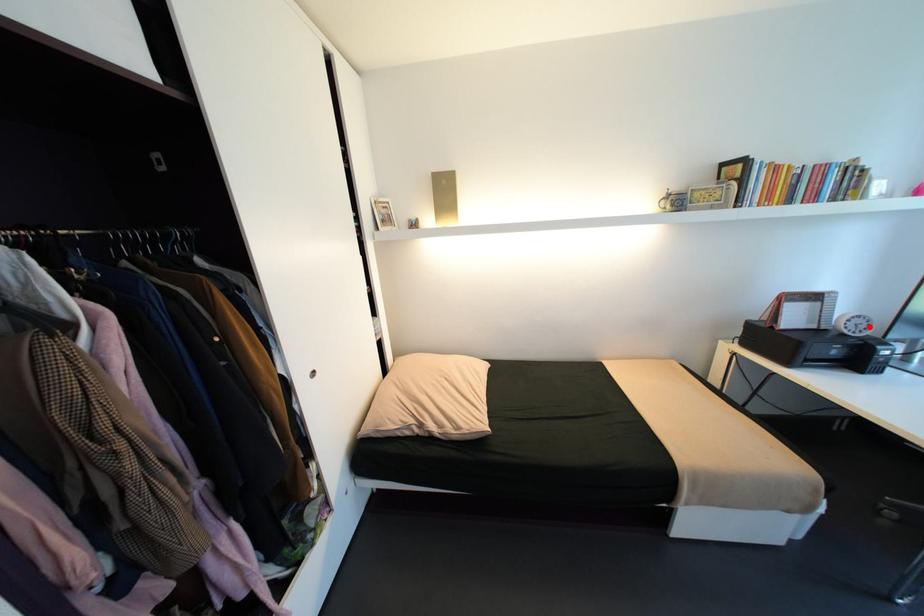
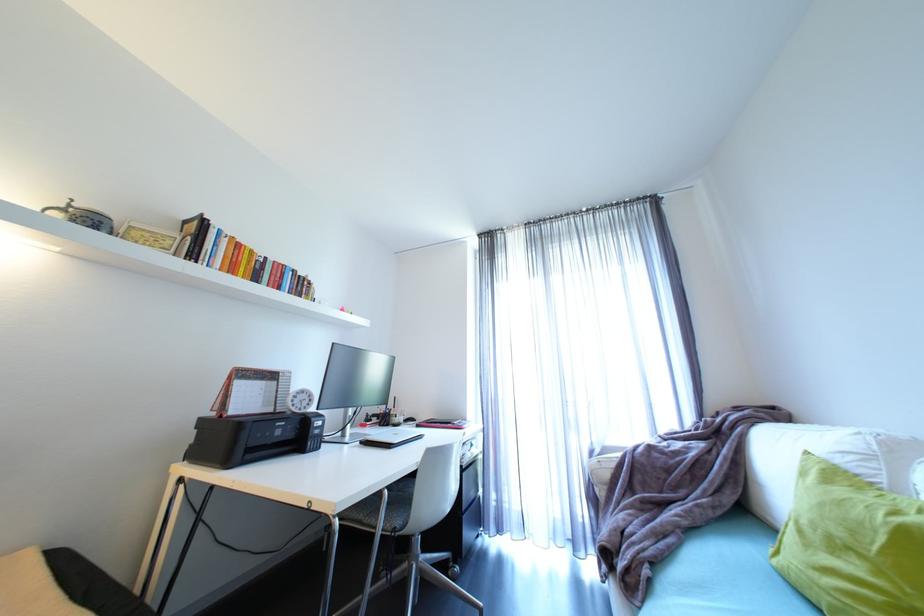
Question: I am providing you with two images of the same scene from different viewpoints. A red point is marked on the first image. Can you still see the location of the red point in image 2?

Choices:
 (A) Yes
 (B) No

Answer: (A)